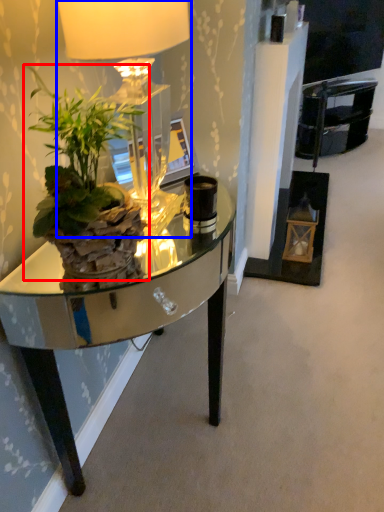
Question: Which point is closer to the camera, houseplant (highlighted by a red box) or lamp (highlighted by a blue box)?

Choices:
 (A) houseplant
 (B) lamp

Answer: (A)